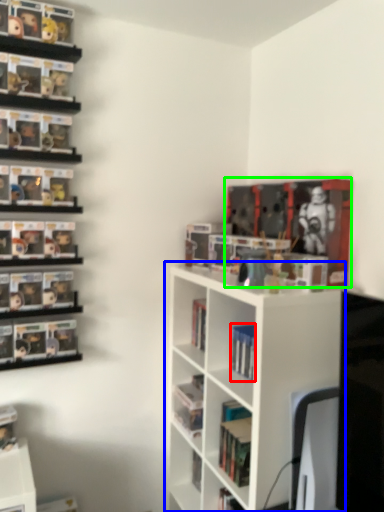
Question: Based on their relative distances, which object is farther from book (highlighted by a red box)? Choose from shelf (highlighted by a blue box) and book (highlighted by a green box).

Choices:
 (A) shelf
 (B) book

Answer: (B)